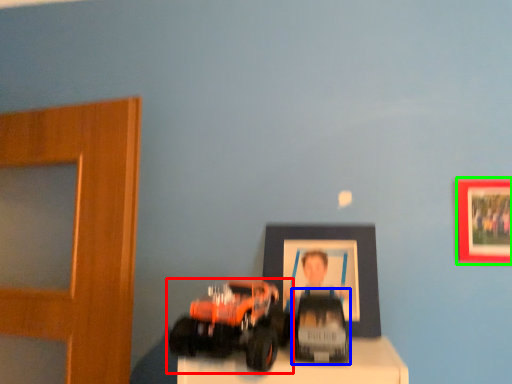
Question: Which is nearer to the toy (highlighted by a red box)? toy (highlighted by a blue box) or picture frame (highlighted by a green box).

Choices:
 (A) toy
 (B) picture frame

Answer: (A)